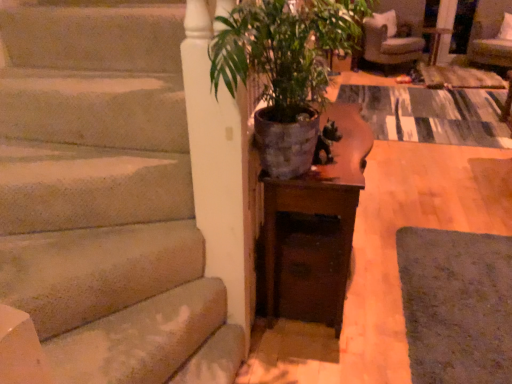
Question: From a real-world perspective, is wooden side table at center on green matte pot at center?

Choices:
 (A) yes
 (B) no

Answer: (B)

Question: From the image's perspective, is wooden side table at center on top of green matte pot at center?

Choices:
 (A) no
 (B) yes

Answer: (B)

Question: Considering the relative positions of wooden side table at center and green matte pot at center in the image provided, is wooden side table at center to the right of green matte pot at center from the viewer's perspective?

Choices:
 (A) no
 (B) yes

Answer: (B)

Question: Is wooden side table at center thinner than green matte pot at center?

Choices:
 (A) yes
 (B) no

Answer: (B)

Question: Is wooden side table at center outside of green matte pot at center?

Choices:
 (A) no
 (B) yes

Answer: (B)

Question: Is wooden side table at center oriented towards green matte pot at center?

Choices:
 (A) no
 (B) yes

Answer: (B)

Question: Does beige fabric armchair at upper right appear on the left side of wooden side table at center?

Choices:
 (A) yes
 (B) no

Answer: (A)

Question: Is beige fabric armchair at upper right smaller than wooden side table at center?

Choices:
 (A) yes
 (B) no

Answer: (B)

Question: Is beige fabric armchair at upper right looking in the opposite direction of wooden side table at center?

Choices:
 (A) yes
 (B) no

Answer: (B)

Question: From the image's perspective, is beige fabric armchair at upper right located above wooden side table at center?

Choices:
 (A) yes
 (B) no

Answer: (A)

Question: Is beige fabric armchair at upper right positioned far away from wooden side table at center?

Choices:
 (A) no
 (B) yes

Answer: (A)

Question: Does beige fabric armchair at upper right have a lesser height compared to wooden side table at center?

Choices:
 (A) yes
 (B) no

Answer: (B)

Question: Is green matte pot at center facing towards velvet beige armchair at upper right?

Choices:
 (A) yes
 (B) no

Answer: (B)